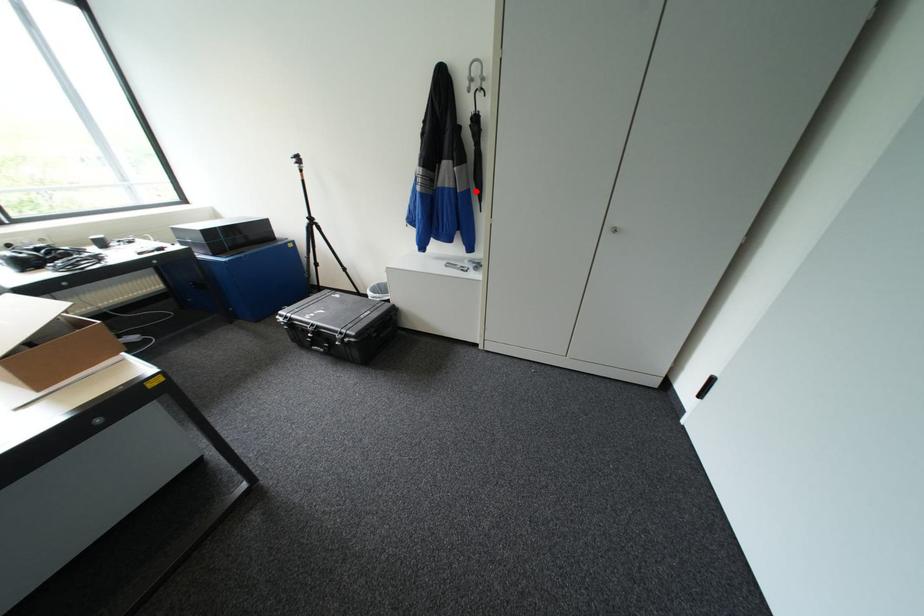
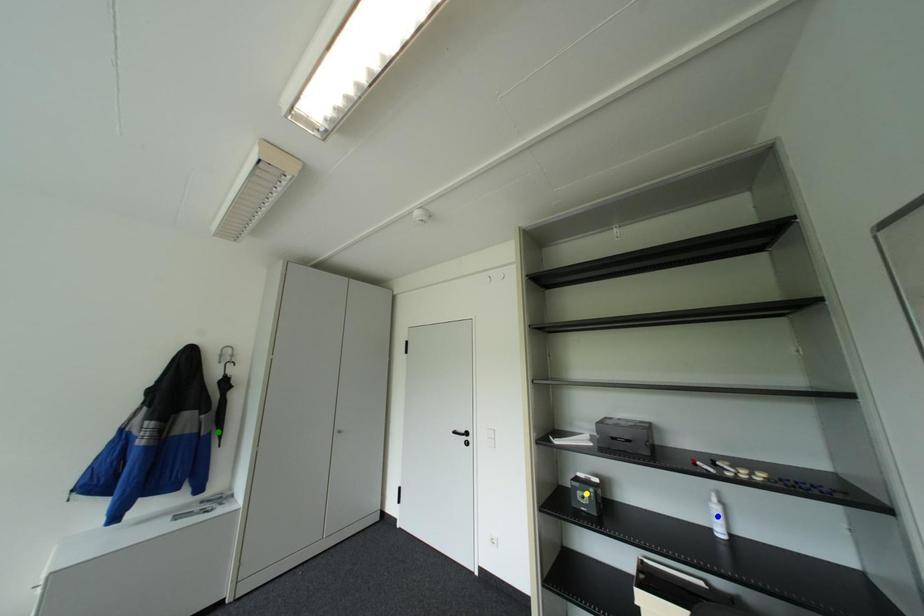
Question: I am providing you with two images of the same scene from different viewpoints. A red point is marked on the first image. You are given multiple points on the second image. Which mark in image 2 goes with the point in image 1?

Choices:
 (A) yellow point
 (B) blue point
 (C) green point

Answer: (C)